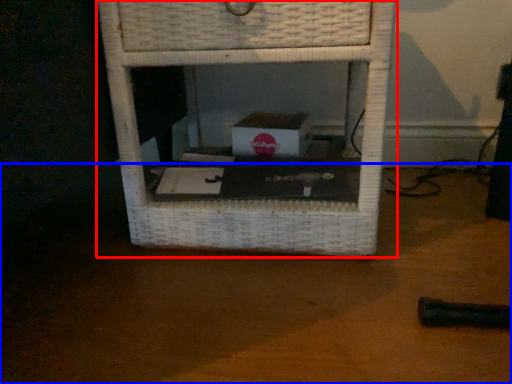
Question: Which point is further to the camera, furniture (highlighted by a red box) or table top (highlighted by a blue box)?

Choices:
 (A) furniture
 (B) table top

Answer: (A)